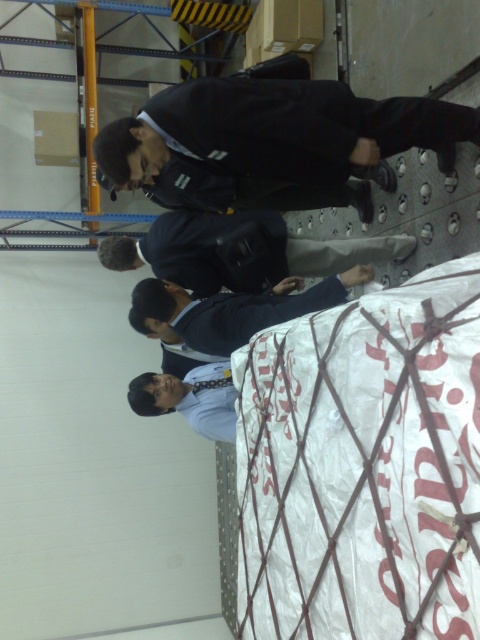
The width and height of the screenshot is (480, 640). What do you see at coordinates (273, 141) in the screenshot? I see `black matte suit at center` at bounding box center [273, 141].

Who is more distant from viewer, (x=232, y=97) or (x=177, y=252)?

The point (x=177, y=252) is more distant.

Locate an element on the screen. This screenshot has width=480, height=640. black matte suit at center is located at coordinates tap(273, 141).

Does black matte suit at center appear under white matte robe at center?

No, black matte suit at center is not below white matte robe at center.

Which is below, black matte suit at center or white matte robe at center?

Positioned lower is white matte robe at center.

This screenshot has height=640, width=480. I want to click on black matte suit at center, so click(x=273, y=141).

Is dark blue suit at center wider than white matte robe at center?

Correct, the width of dark blue suit at center exceeds that of white matte robe at center.

Who is more forward, (118, 253) or (192, 307)?

Positioned in front is point (192, 307).

Where is `dark blue suit at center`? Image resolution: width=480 pixels, height=640 pixels. dark blue suit at center is located at coordinates (220, 262).